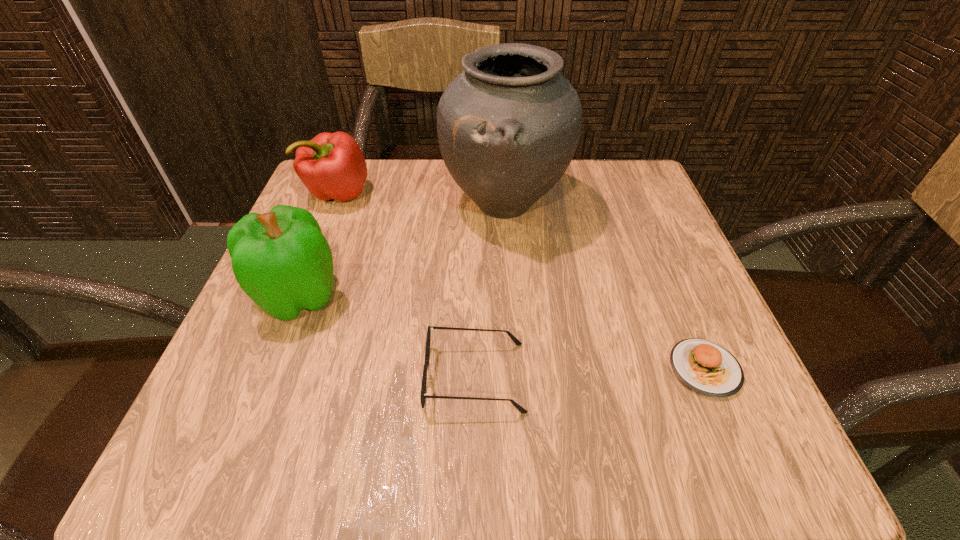
The image size is (960, 540). In order to click on urn in this screenshot , I will do `click(508, 126)`.

The width and height of the screenshot is (960, 540). In order to click on the third farthest object in this screenshot , I will do `click(281, 260)`.

Where is `the taller bell pepper`? the taller bell pepper is located at coordinates (281, 260).

Locate an element on the screen. The width and height of the screenshot is (960, 540). the farther bell pepper is located at coordinates 331,165.

Image resolution: width=960 pixels, height=540 pixels. Identify the location of the third tallest object. (331, 165).

Where is `spectacles`? This screenshot has height=540, width=960. spectacles is located at coordinates (423, 395).

Find the location of a particular element. This screenshot has height=540, width=960. food is located at coordinates (707, 368).

The image size is (960, 540). I want to click on the rightmost object, so click(707, 368).

Locate an element on the screen. vacant space situated on the front of the urn is located at coordinates (519, 428).

The image size is (960, 540). Find the location of `vacant space located 0.090m on the front of the fourth shortest object`. vacant space located 0.090m on the front of the fourth shortest object is located at coordinates (265, 382).